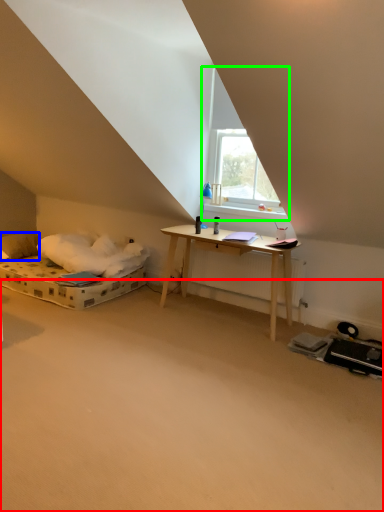
Question: Considering the real-world distances, which object is closest to plain (highlighted by a red box)? pillow (highlighted by a blue box) or window (highlighted by a green box).

Choices:
 (A) pillow
 (B) window

Answer: (B)